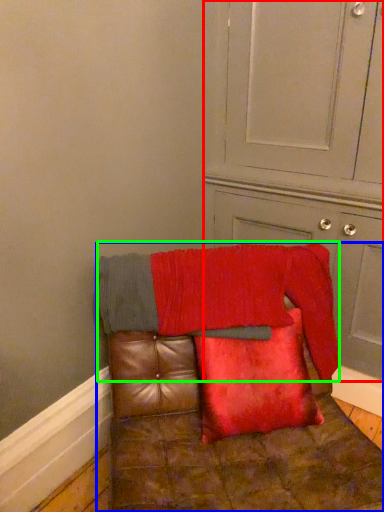
Question: Which object is the farthest from dresser (highlighted by a red box)? Choose among these: furniture (highlighted by a blue box) or blanket (highlighted by a green box).

Choices:
 (A) furniture
 (B) blanket

Answer: (A)